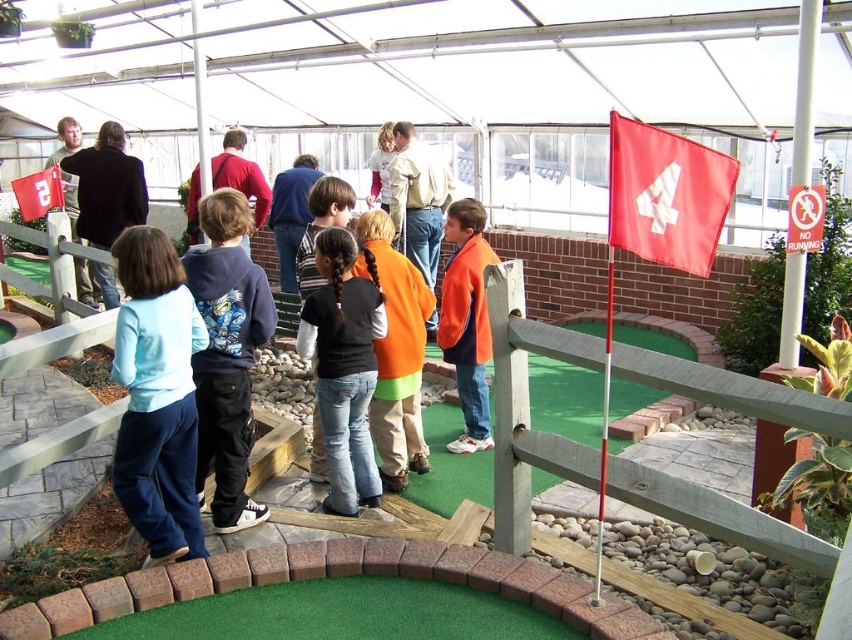
You are a photographer trying to capture both the orange fleece jacket at center and the matte black jacket at upper left in a single shot. Based on their positions, which jacket is closer to the camera?

The orange fleece jacket at center is closer to the camera because it is positioned below the matte black jacket at upper left, indicating it is lower in the frame and thus nearer.